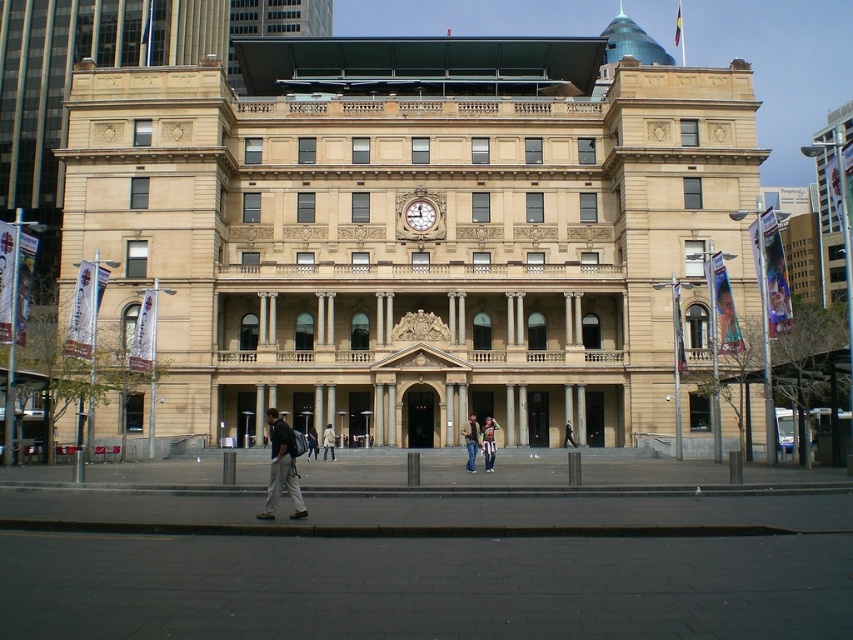
Is point (285, 483) more distant than point (469, 458)?

That is False.

Can you confirm if dark gray fabric pants at lower left is smaller than denim jacket at center?

No, dark gray fabric pants at lower left is not smaller than denim jacket at center.

In the scene shown: Who is more forward, (271, 472) or (467, 435)?

Point (271, 472) is more forward.

This screenshot has height=640, width=853. Find the location of `dark gray fabric pants at lower left`. dark gray fabric pants at lower left is located at coordinates (281, 467).

Does point (280, 458) come closer to viewer compared to point (312, 436)?

Yes, point (280, 458) is in front of point (312, 436).

Is dark gray fabric pants at lower left taller than dark blue jeans at center?

Yes.

Is point (300, 508) closer to viewer compared to point (315, 452)?

Yes, point (300, 508) is in front of point (315, 452).

Where is `dark gray fabric pants at lower left`? dark gray fabric pants at lower left is located at coordinates (281, 467).

What do you see at coordinates (281, 467) in the screenshot?
I see `dark gray fabric pants at lower left` at bounding box center [281, 467].

Which is more to the right, dark gray fabric pants at lower left or gold metallic clock at center?

gold metallic clock at center

Find the location of a particular element. This screenshot has width=853, height=640. dark gray fabric pants at lower left is located at coordinates (281, 467).